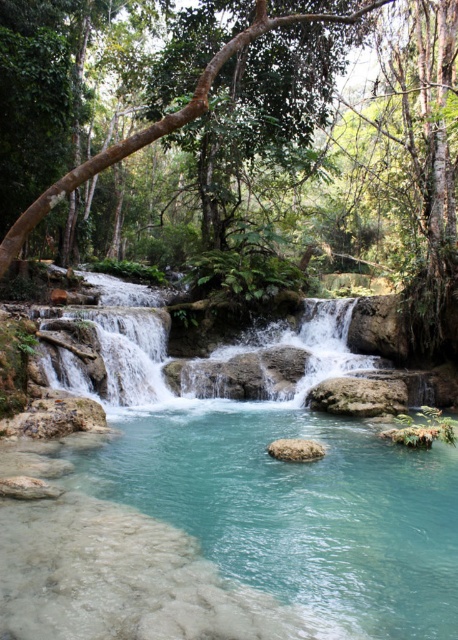
Question: Does clear glass stream at center appear under clear stone waterfall at center?

Choices:
 (A) yes
 (B) no

Answer: (A)

Question: Is clear glass stream at center wider than clear stone waterfall at center?

Choices:
 (A) yes
 (B) no

Answer: (B)

Question: Which point appears closest to the camera in this image?

Choices:
 (A) (416, 577)
 (B) (402, 394)
 (C) (103, 163)

Answer: (C)

Question: Does rough textured rock at center lie behind smooth gray rock at center?

Choices:
 (A) no
 (B) yes

Answer: (B)

Question: Among these points, which one is farthest from the camera?

Choices:
 (A) (140, 492)
 (B) (162, 125)
 (C) (327, 396)
 (D) (85, 390)

Answer: (C)

Question: Among these objects, which one is nearest to the camera?

Choices:
 (A) smooth gray rock at center
 (B) rough textured rock at center

Answer: (A)